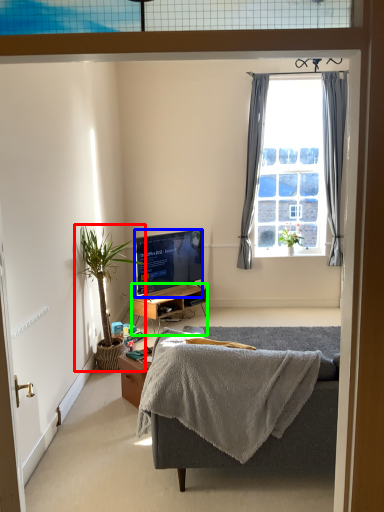
Question: Based on their relative distances, which object is farther from houseplant (highlighted by a red box)? Choose from television (highlighted by a blue box) and desk (highlighted by a green box).

Choices:
 (A) television
 (B) desk

Answer: (B)